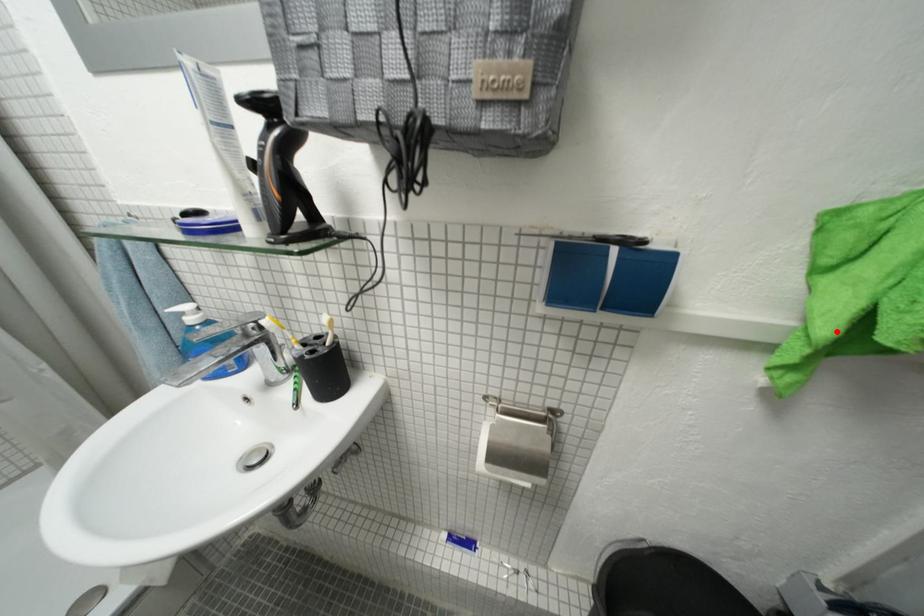
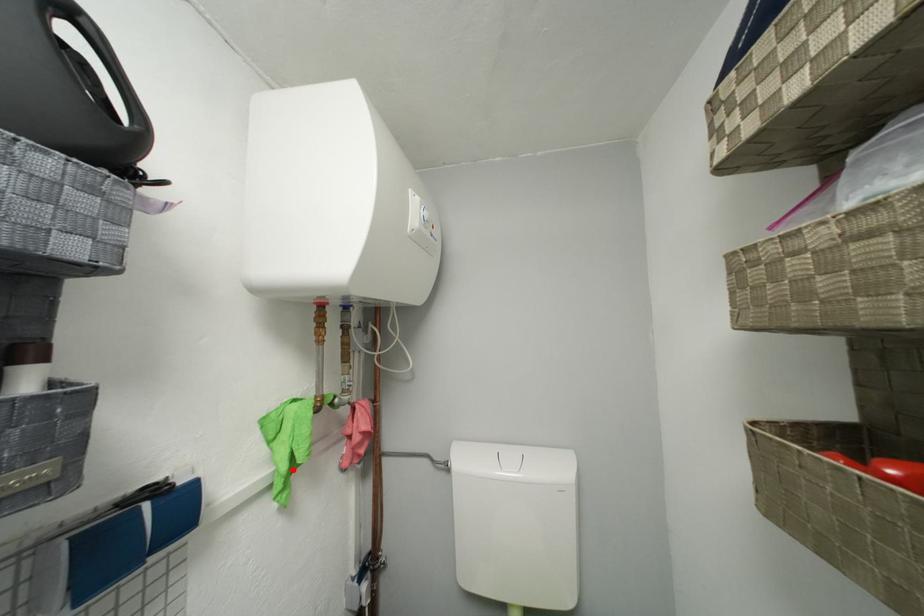
I am providing you with two images of the same scene from different viewpoints. A red point is marked on the first image and another point is marked on the second image. Are the points marked in image1 and image2 representing the same 3D position?

Yes